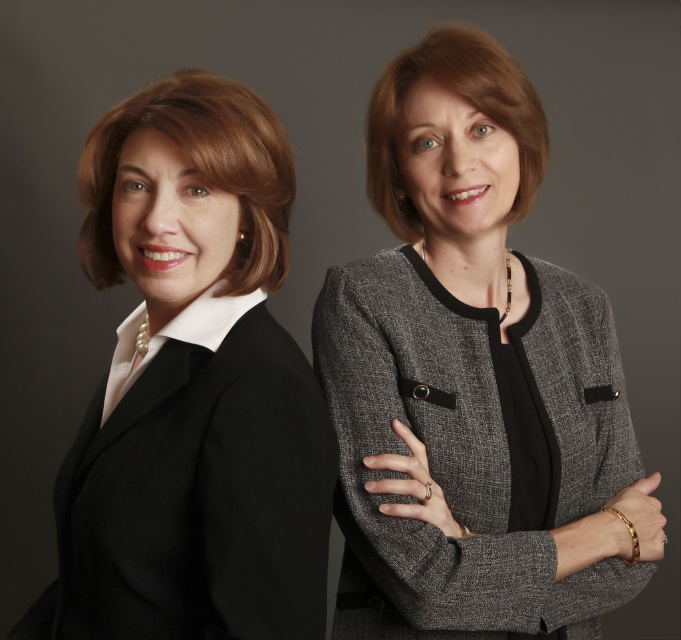
Question: Which point is closer to the camera?

Choices:
 (A) black matte blazer at left
 (B) matte gray blazer at center
 (C) gray textured blazer at center

Answer: (A)

Question: Can you confirm if matte gray blazer at center is positioned to the right of black matte blazer at left?

Choices:
 (A) yes
 (B) no

Answer: (A)

Question: Is matte gray blazer at center further to the viewer compared to black matte blazer at left?

Choices:
 (A) no
 (B) yes

Answer: (B)

Question: Which point is farther to the camera?

Choices:
 (A) (620, 524)
 (B) (304, 490)
 (C) (516, 588)

Answer: (A)

Question: Estimate the real-world distances between objects in this image. Which object is farther from the black matte blazer at left?

Choices:
 (A) matte gray blazer at center
 (B) gray textured blazer at center

Answer: (B)

Question: Where is matte gray blazer at center located in relation to black matte blazer at left in the image?

Choices:
 (A) below
 (B) above

Answer: (B)